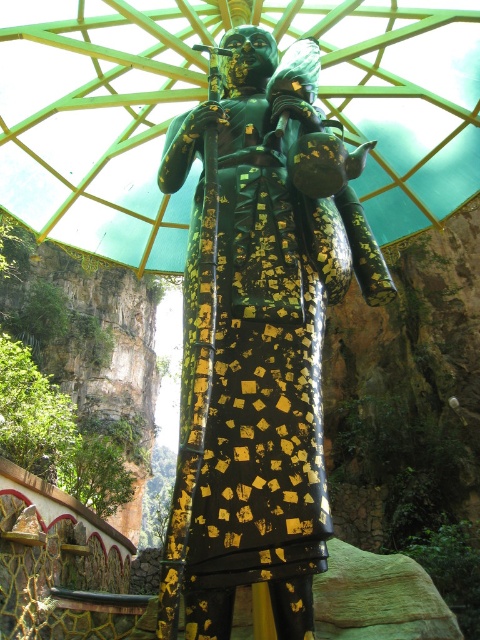
Question: Does gold leafed statue at center have a smaller size compared to green glossy umbrella at center?

Choices:
 (A) yes
 (B) no

Answer: (A)

Question: Among these objects, which one is nearest to the camera?

Choices:
 (A) green glossy umbrella at center
 (B) gold leafed statue at center

Answer: (B)

Question: Among these objects, which one is farthest from the camera?

Choices:
 (A) green glossy umbrella at center
 (B) gold leafed statue at center

Answer: (A)

Question: Which of the following is the farthest from the observer?

Choices:
 (A) gold leafed statue at center
 (B) green glossy umbrella at center

Answer: (B)

Question: Is gold leafed statue at center thinner than green glossy umbrella at center?

Choices:
 (A) yes
 (B) no

Answer: (A)

Question: Does gold leafed statue at center have a smaller size compared to green glossy umbrella at center?

Choices:
 (A) yes
 (B) no

Answer: (A)